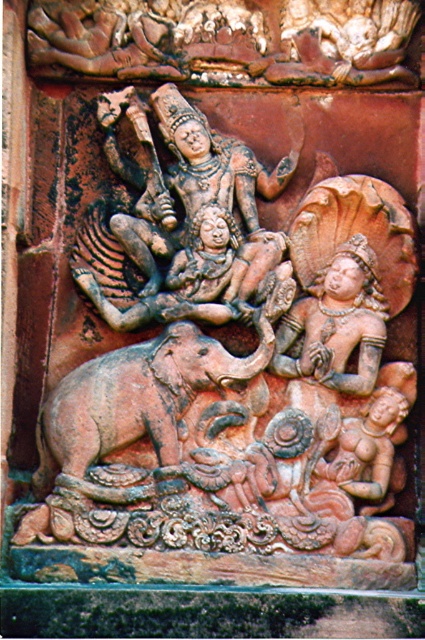
Does terracotta statue at center have a greater height compared to terracotta elephant at center?

Correct, terracotta statue at center is much taller as terracotta elephant at center.

Who is more distant from viewer, [118,406] or [175,461]?

Point [118,406]

Who is more distant from viewer, (20, 531) or (187, 372)?

The point (187, 372) is more distant.

At what (x,y) coordinates should I click in order to perform the action: click on terracotta statue at center. Please return your answer as a coordinate pair (x, y). Looking at the image, I should click on point(226,355).

Does terracotta statue at center come in front of rustic stone statue at center?

Yes, it is in front of rustic stone statue at center.

Can you confirm if terracotta statue at center is taller than rustic stone statue at center?

Yes, terracotta statue at center is taller than rustic stone statue at center.

Between point (158, 90) and point (183, 218), which one is positioned in front?

Point (183, 218) is in front.

Identify the location of terracotta statue at center. Image resolution: width=425 pixels, height=640 pixels. (226, 355).

Can you confirm if rustic stone statue at center is smaller than terracotta elephant at center?

Actually, rustic stone statue at center might be larger than terracotta elephant at center.

Describe the element at coordinates (187, 220) in the screenshot. The width and height of the screenshot is (425, 640). I see `rustic stone statue at center` at that location.

Where is `rustic stone statue at center`? Image resolution: width=425 pixels, height=640 pixels. rustic stone statue at center is located at coordinates (187, 220).